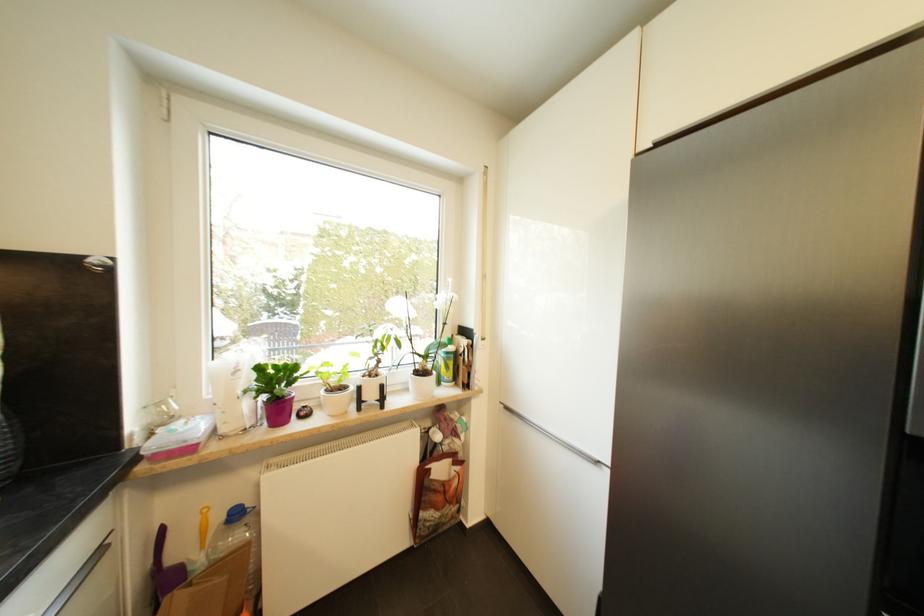
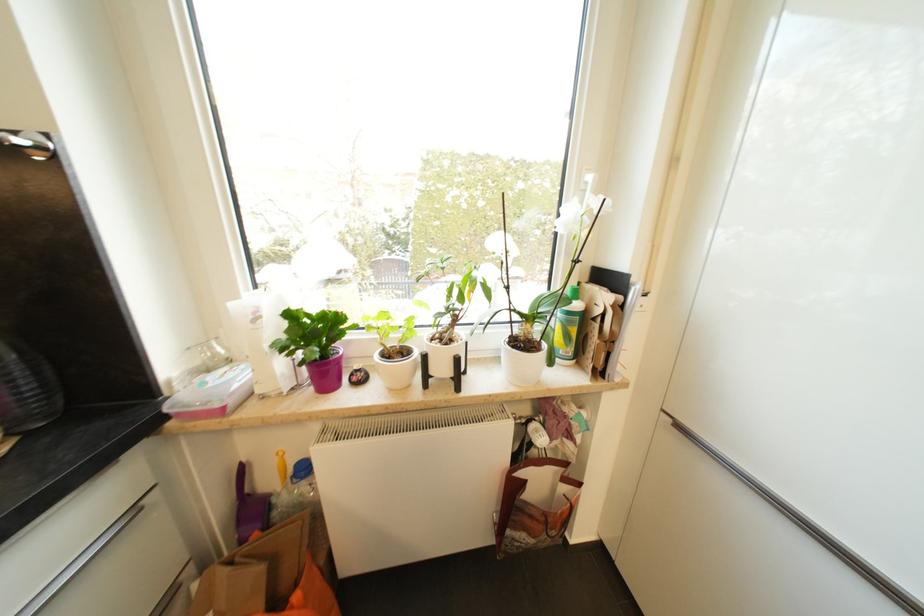
Where in the second image is the point corresponding to (x=375, y=397) from the first image?

(446, 371)